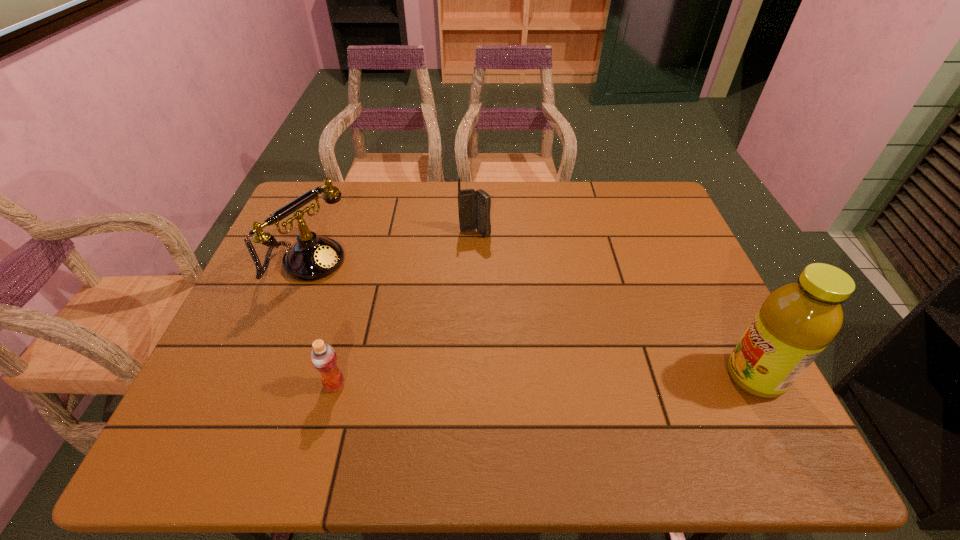
Locate an element on the screen. The height and width of the screenshot is (540, 960). blank area located on the keyboard of the cellular telephone is located at coordinates (492, 293).

You are a GUI agent. You are given a task and a screenshot of the screen. Output one action in this format:
    pyautogui.click(x=<x>, y=<y>)
    Task: Click on the free space located on the keyboard of the cellular telephone
    
    Given the screenshot: What is the action you would take?
    pyautogui.click(x=490, y=285)

Locate an element on the screen. The width and height of the screenshot is (960, 540). free spot located 0.230m on the keyboard of the cellular telephone is located at coordinates (492, 295).

Where is `vacant space located on the dial of the telephone`? This screenshot has height=540, width=960. vacant space located on the dial of the telephone is located at coordinates (403, 318).

Locate an element on the screen. vacant area situated on the dial of the telephone is located at coordinates (432, 333).

This screenshot has height=540, width=960. Identify the location of free space located 0.190m on the dial of the telephone. (388, 309).

I want to click on orange juice that is positioned at the near edge, so click(323, 357).

Locate an element on the screen. The height and width of the screenshot is (540, 960). fruit juice present at the near edge is located at coordinates (797, 321).

Identify the location of object that is positioned at the left edge. (312, 257).

Find the location of a particular element. The image size is (960, 540). object that is at the right edge is located at coordinates (797, 321).